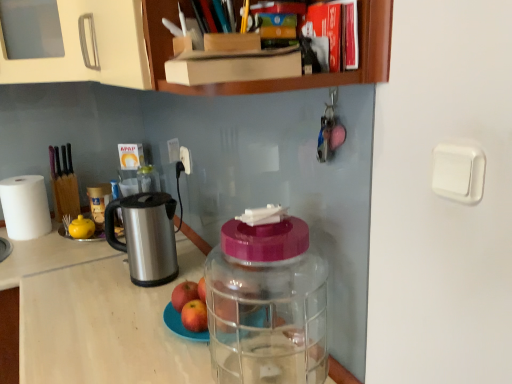
The image size is (512, 384). What are the coordinates of `blank space situated above transparent plastic container at center (from a real-world perspective)` in the screenshot? It's located at (116, 306).